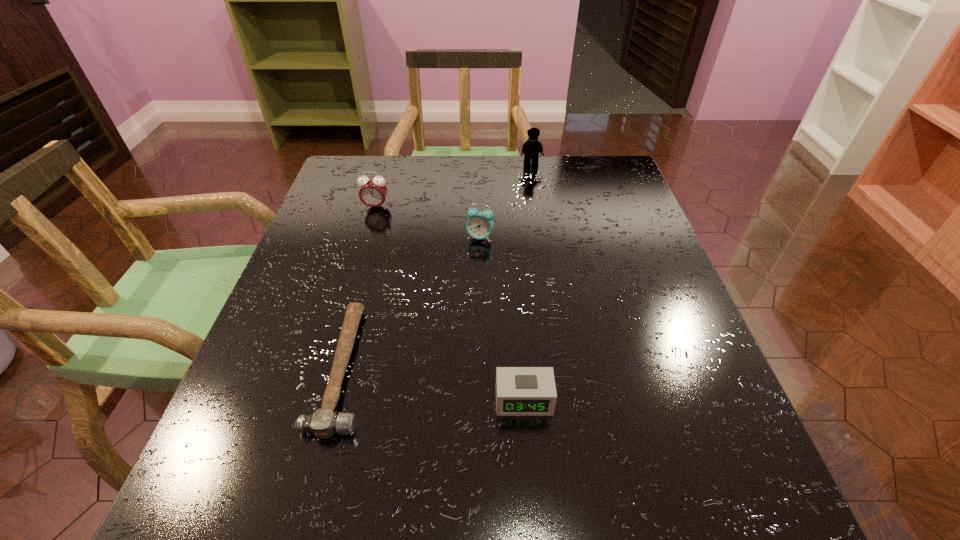
Where is `vacant area situated 0.120m on the front-facing side of the nearest alarm clock`? This screenshot has width=960, height=540. vacant area situated 0.120m on the front-facing side of the nearest alarm clock is located at coordinates (531, 495).

Image resolution: width=960 pixels, height=540 pixels. I want to click on free space located 0.380m on the striking face of the hammer, so click(x=588, y=368).

This screenshot has height=540, width=960. Identify the location of Lego that is at the far edge. (532, 147).

Find the location of a particular element. This screenshot has width=960, height=540. alarm clock that is at the far edge is located at coordinates (373, 191).

The height and width of the screenshot is (540, 960). I want to click on alarm clock that is positioned at the left edge, so click(373, 191).

Find the location of a particular element. hammer that is at the left edge is located at coordinates (323, 423).

You are a GUI agent. You are given a task and a screenshot of the screen. Output one action in this format:
    pyautogui.click(x=<x>, y=<y>)
    Task: Click on the object that is positioned at the far left corner
    This screenshot has height=540, width=960.
    Given the screenshot: What is the action you would take?
    pyautogui.click(x=373, y=191)

What are the coordinates of `vacant space at the far edge of the desktop` in the screenshot? It's located at (483, 158).

The height and width of the screenshot is (540, 960). I want to click on vacant space at the near edge, so click(509, 496).

Locate an element on the screen. blank space at the left edge of the desktop is located at coordinates (279, 368).